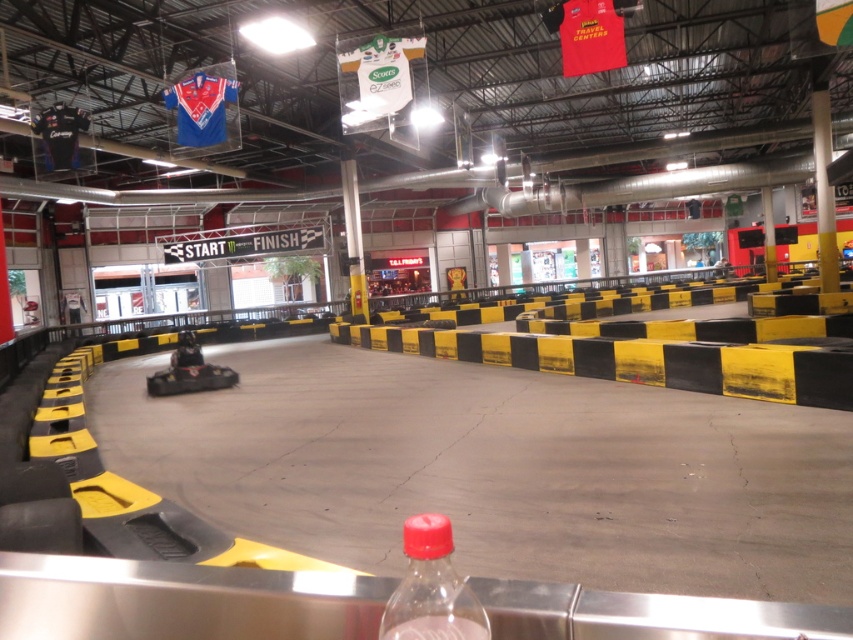
Question: Which point appears closest to the camera in this image?

Choices:
 (A) coord(422,557)
 (B) coord(202,412)

Answer: (A)

Question: Can you confirm if yellow/black striped race track at center is positioned to the left of clear plastic bottle at lower center?

Choices:
 (A) no
 (B) yes

Answer: (B)

Question: Does yellow/black striped race track at center have a greater width compared to clear plastic bottle at lower center?

Choices:
 (A) yes
 (B) no

Answer: (A)

Question: Which point appears closest to the camera in this image?

Choices:
 (A) (134, 476)
 (B) (422, 540)

Answer: (B)

Question: Is yellow/black striped race track at center smaller than clear plastic bottle at lower center?

Choices:
 (A) no
 (B) yes

Answer: (A)

Question: Which of the following is the closest to the observer?

Choices:
 (A) yellow/black striped race track at center
 (B) clear plastic bottle at lower center

Answer: (B)